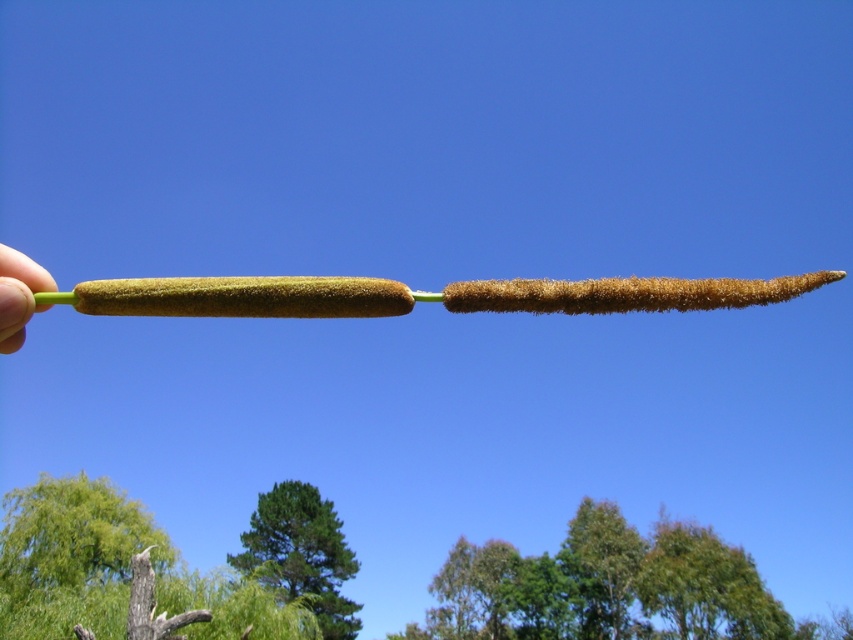
Question: Does green leafy tree at upper center have a greater width compared to green fuzzy tree at center?

Choices:
 (A) no
 (B) yes

Answer: (B)

Question: Which of these objects is positioned farthest from the green fuzzy tree at center?

Choices:
 (A) green leafy tree at upper center
 (B) green flesh at left

Answer: (B)

Question: Is green fuzzy tree at center to the right of green flesh at left from the viewer's perspective?

Choices:
 (A) no
 (B) yes

Answer: (A)

Question: Which point is farther from the camera taking this photo?

Choices:
 (A) (4, 291)
 (B) (595, 602)
 (C) (334, 605)

Answer: (B)

Question: Which object is farther from the camera taking this photo?

Choices:
 (A) green flesh at left
 (B) green fuzzy tree at center

Answer: (B)

Question: Can you confirm if green leafy tree at upper center is bigger than green fuzzy tree at center?

Choices:
 (A) yes
 (B) no

Answer: (A)